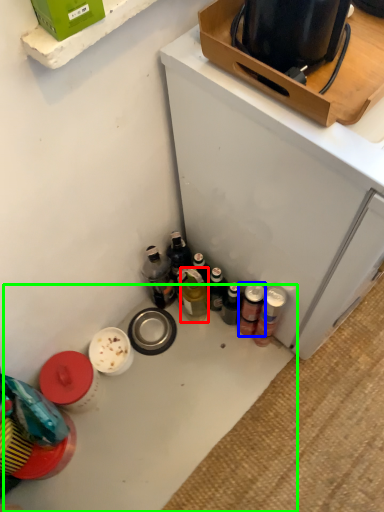
Question: Which object is the closest to the bottle (highlighted by a red box)? Choose among these: beverage (highlighted by a blue box) or table (highlighted by a green box).

Choices:
 (A) beverage
 (B) table

Answer: (A)